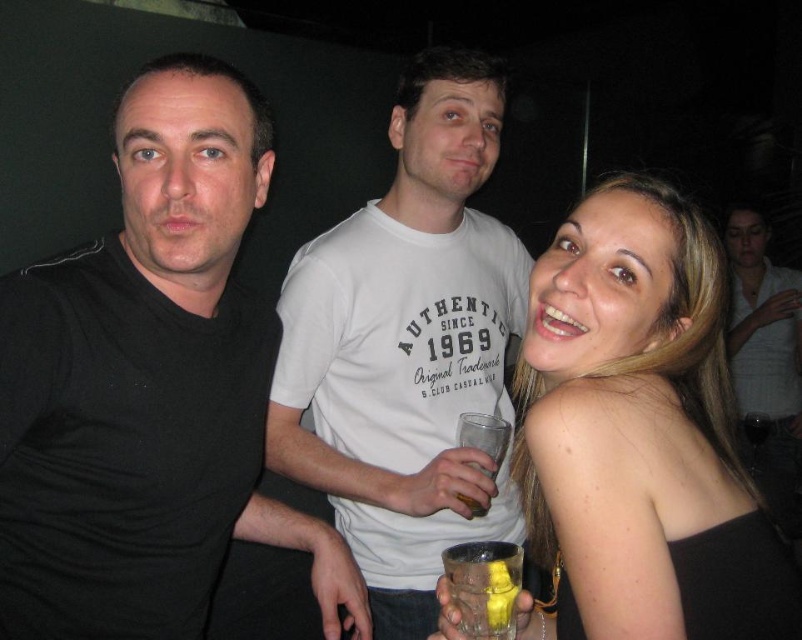
Question: Among these points, which one is farthest from the camera?

Choices:
 (A) (788, 492)
 (B) (185, 314)
 (C) (509, 554)
 (D) (428, 509)

Answer: (A)

Question: Does black matte dress at center lie in front of white cotton shirt at upper right?

Choices:
 (A) yes
 (B) no

Answer: (A)

Question: Can you confirm if white cotton shirt at upper right is positioned below translucent glass at lower right?

Choices:
 (A) yes
 (B) no

Answer: (B)

Question: Does white cotton t-shirt at center have a lesser width compared to translucent glass at lower right?

Choices:
 (A) no
 (B) yes

Answer: (A)

Question: Which point is closer to the camera?

Choices:
 (A) translucent glass at center
 (B) white cotton t-shirt at center

Answer: (B)

Question: Which point appears farthest from the camera in this image?

Choices:
 (A) (519, 556)
 (B) (466, 177)
 (C) (484, 465)
 (D) (209, 476)

Answer: (B)